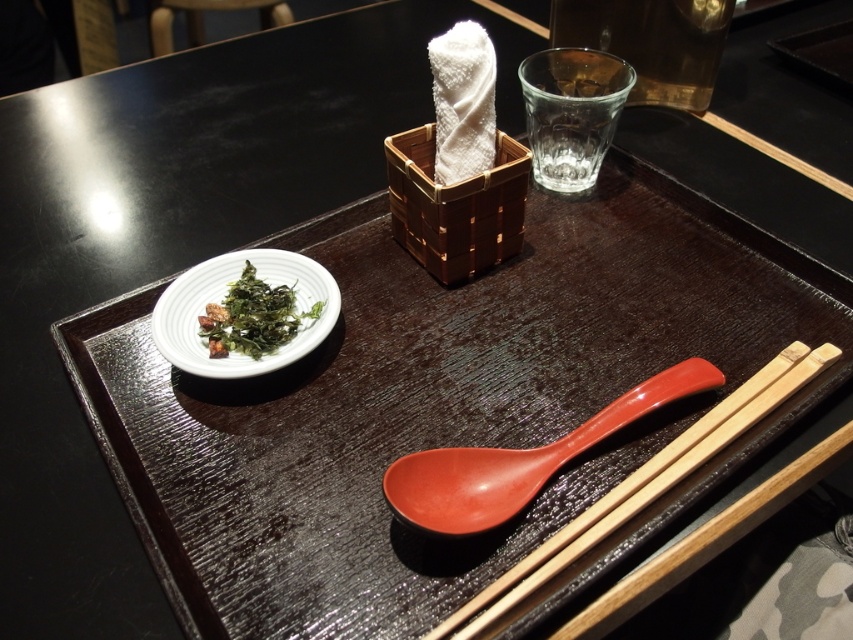
Question: Estimate the real-world distances between objects in this image. Which object is closer to the wooden chopsticks at lower right?

Choices:
 (A) matte orange spoon at lower center
 (B) green leafymaterial/texture at left

Answer: (A)

Question: Among these points, which one is nearest to the camera?

Choices:
 (A) (268, 310)
 (B) (393, 490)

Answer: (B)

Question: Which point is farther to the camera?

Choices:
 (A) (260, 348)
 (B) (476, 497)

Answer: (A)

Question: Is matte orange spoon at lower center above wooden chopsticks at lower right?

Choices:
 (A) yes
 (B) no

Answer: (A)

Question: Can you confirm if matte orange spoon at lower center is positioned above green leafymaterial/texture at left?

Choices:
 (A) no
 (B) yes

Answer: (A)

Question: Is matte orange spoon at lower center smaller than green leafymaterial/texture at left?

Choices:
 (A) yes
 (B) no

Answer: (B)